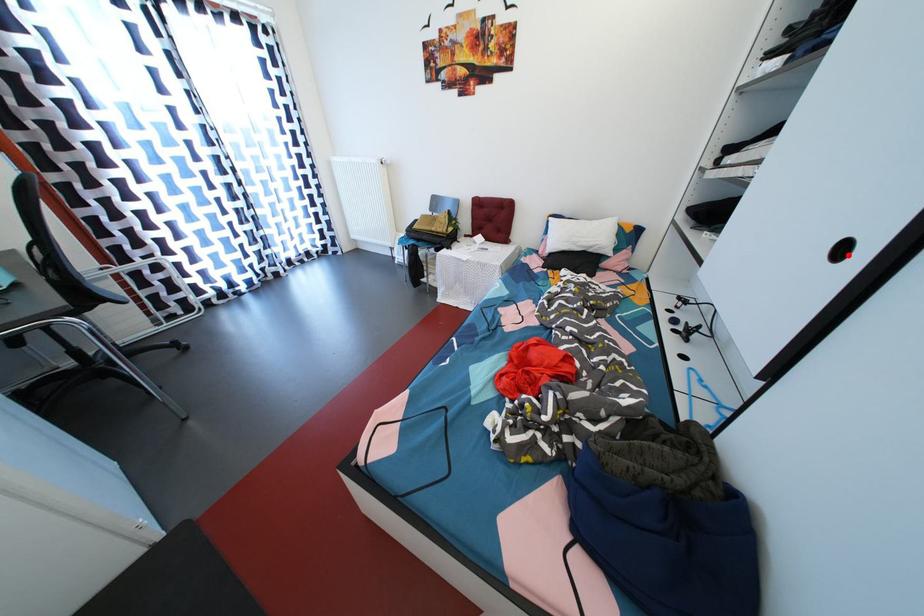
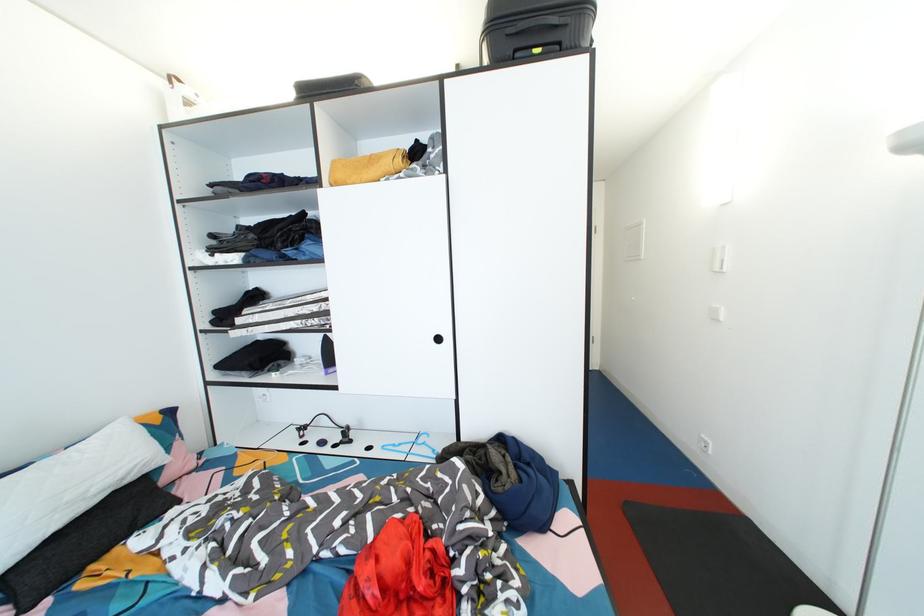
Question: I am providing you with two images of the same scene from different viewpoints. In image1, a red point is highlighted. Considering the same 3D point in image2, which of the following is correct?

Choices:
 (A) It is closer
 (B) It is farther

Answer: (A)